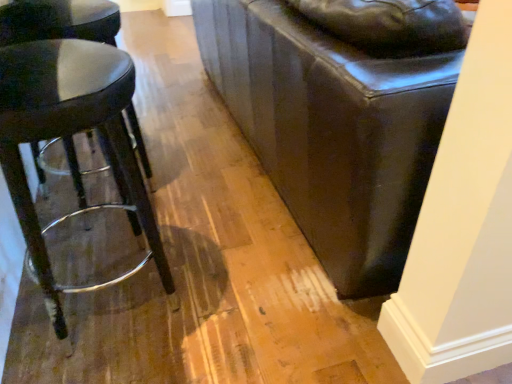
Describe the element at coordinates (58, 20) in the screenshot. I see `matte black stool at left, positioned as the second stool in front-to-back order` at that location.

Measure the distance between matte black stool at left, acting as the first stool starting from the back, and camera.

They are 39.09 inches apart.

Find the location of a particular element. Image resolution: width=512 pixels, height=384 pixels. matte black stool at left, acting as the first stool starting from the back is located at coordinates (58, 20).

The width and height of the screenshot is (512, 384). What do you see at coordinates (69, 133) in the screenshot?
I see `matte black stool at left, marked as the first stool in a front-to-back arrangement` at bounding box center [69, 133].

Where is `matte black stool at left, the second stool viewed from the back`? The width and height of the screenshot is (512, 384). matte black stool at left, the second stool viewed from the back is located at coordinates (69, 133).

In order to face matte black stool at left, the second stool viewed from the back, should I rotate leftwards or rightwards?

Rotate left and turn 22.717 degrees.

Find the location of a particular element. matte black stool at left, acting as the first stool starting from the back is located at coordinates (58, 20).

Which object is positioned more to the right, matte black stool at left, marked as the first stool in a front-to-back arrangement, or matte black stool at left, positioned as the second stool in front-to-back order?

From the viewer's perspective, matte black stool at left, marked as the first stool in a front-to-back arrangement, appears more on the right side.

In the scene shown: Which object is closer to the camera taking this photo, matte black stool at left, the second stool viewed from the back, or matte black stool at left, acting as the first stool starting from the back?

Positioned in front is matte black stool at left, the second stool viewed from the back.

Considering the points (90, 210) and (76, 34), which point is in front, point (90, 210) or point (76, 34)?

The point (76, 34) is closer.

From the image's perspective, which is below, matte black stool at left, the second stool viewed from the back, or matte black stool at left, positioned as the second stool in front-to-back order?

matte black stool at left, the second stool viewed from the back.

From a real-world perspective, is matte black stool at left, marked as the first stool in a front-to-back arrangement, on matte black stool at left, positioned as the second stool in front-to-back order?

Indeed, from a real-world perspective, matte black stool at left, marked as the first stool in a front-to-back arrangement, stands above matte black stool at left, positioned as the second stool in front-to-back order.

Is matte black stool at left, the second stool viewed from the back, thinner than matte black stool at left, acting as the first stool starting from the back?

Yes.

From the picture: Considering the sizes of objects matte black stool at left, marked as the first stool in a front-to-back arrangement, and matte black stool at left, acting as the first stool starting from the back, in the image provided, who is taller, matte black stool at left, marked as the first stool in a front-to-back arrangement, or matte black stool at left, acting as the first stool starting from the back,?

matte black stool at left, acting as the first stool starting from the back.

Considering the relative sizes of matte black stool at left, marked as the first stool in a front-to-back arrangement, and matte black stool at left, positioned as the second stool in front-to-back order, in the image provided, is matte black stool at left, marked as the first stool in a front-to-back arrangement, smaller than matte black stool at left, positioned as the second stool in front-to-back order,?

Yes, matte black stool at left, marked as the first stool in a front-to-back arrangement, is smaller than matte black stool at left, positioned as the second stool in front-to-back order.

Is matte black stool at left, positioned as the second stool in front-to-back order, inside matte black stool at left, the second stool viewed from the back?

That's incorrect, matte black stool at left, positioned as the second stool in front-to-back order, is not inside matte black stool at left, the second stool viewed from the back.

Would you say matte black stool at left, the second stool viewed from the back, is a long distance from matte black stool at left, positioned as the second stool in front-to-back order?

No, matte black stool at left, the second stool viewed from the back, is not far from matte black stool at left, positioned as the second stool in front-to-back order.

Could you tell me if matte black stool at left, marked as the first stool in a front-to-back arrangement, is turned towards matte black stool at left, positioned as the second stool in front-to-back order?

No, matte black stool at left, marked as the first stool in a front-to-back arrangement, is not oriented towards matte black stool at left, positioned as the second stool in front-to-back order.

There is a matte black stool at left, positioned as the second stool in front-to-back order. Identify the location of stool above it (from a real-world perspective). (69, 133).

Looking at this image, considering the relative positions of matte black stool at left, acting as the first stool starting from the back, and matte black stool at left, the second stool viewed from the back, in the image provided, is matte black stool at left, acting as the first stool starting from the back, to the right of matte black stool at left, the second stool viewed from the back, from the viewer's perspective?

No.

In the scene shown: Is matte black stool at left, acting as the first stool starting from the back, closer to the viewer compared to matte black stool at left, marked as the first stool in a front-to-back arrangement?

No, the depth of matte black stool at left, acting as the first stool starting from the back, is greater than that of matte black stool at left, marked as the first stool in a front-to-back arrangement.

Considering the positions of point (146, 171) and point (120, 115), is point (146, 171) closer or farther from the camera than point (120, 115)?

Point (146, 171) is positioned farther from the camera compared to point (120, 115).

From the image's perspective, which is below, matte black stool at left, acting as the first stool starting from the back, or matte black stool at left, marked as the first stool in a front-to-back arrangement?

matte black stool at left, marked as the first stool in a front-to-back arrangement.

From a real-world perspective, is matte black stool at left, positioned as the second stool in front-to-back order, on top of matte black stool at left, the second stool viewed from the back?

Actually, matte black stool at left, positioned as the second stool in front-to-back order, is physically below matte black stool at left, the second stool viewed from the back, in the real world.

Considering the relative sizes of matte black stool at left, positioned as the second stool in front-to-back order, and matte black stool at left, marked as the first stool in a front-to-back arrangement, in the image provided, is matte black stool at left, positioned as the second stool in front-to-back order, thinner than matte black stool at left, marked as the first stool in a front-to-back arrangement,?

In fact, matte black stool at left, positioned as the second stool in front-to-back order, might be wider than matte black stool at left, marked as the first stool in a front-to-back arrangement.

Considering the sizes of matte black stool at left, acting as the first stool starting from the back, and matte black stool at left, marked as the first stool in a front-to-back arrangement, in the image, is matte black stool at left, acting as the first stool starting from the back, taller or shorter than matte black stool at left, marked as the first stool in a front-to-back arrangement,?

A: In the image, matte black stool at left, acting as the first stool starting from the back, appears to be taller than matte black stool at left, marked as the first stool in a front-to-back arrangement.

Considering the relative sizes of matte black stool at left, acting as the first stool starting from the back, and matte black stool at left, the second stool viewed from the back, in the image provided, is matte black stool at left, acting as the first stool starting from the back, bigger than matte black stool at left, the second stool viewed from the back,?

Indeed, matte black stool at left, acting as the first stool starting from the back, has a larger size compared to matte black stool at left, the second stool viewed from the back.

Is matte black stool at left, marked as the first stool in a front-to-back arrangement, completely or partially inside matte black stool at left, acting as the first stool starting from the back?

No, matte black stool at left, marked as the first stool in a front-to-back arrangement, is not surrounded by matte black stool at left, acting as the first stool starting from the back.

Are matte black stool at left, acting as the first stool starting from the back, and matte black stool at left, marked as the first stool in a front-to-back arrangement, making contact?

No, matte black stool at left, acting as the first stool starting from the back, is not touching matte black stool at left, marked as the first stool in a front-to-back arrangement.

Is matte black stool at left, acting as the first stool starting from the back, turned away from matte black stool at left, the second stool viewed from the back?

No, matte black stool at left, acting as the first stool starting from the back,'s orientation is not away from matte black stool at left, the second stool viewed from the back.

What's the angular difference between matte black stool at left, acting as the first stool starting from the back, and matte black stool at left, the second stool viewed from the back,'s facing directions?

matte black stool at left, acting as the first stool starting from the back, and matte black stool at left, the second stool viewed from the back, are facing 6.09e-05 degrees away from each other.

Measure the distance from matte black stool at left, acting as the first stool starting from the back, to matte black stool at left, marked as the first stool in a front-to-back arrangement.

matte black stool at left, acting as the first stool starting from the back, and matte black stool at left, marked as the first stool in a front-to-back arrangement, are 15.06 inches apart from each other.

Find the location of a particular element. The image size is (512, 384). stool behind the matte black stool at left, the second stool viewed from the back is located at coordinates (58, 20).

The image size is (512, 384). Find the location of `stool lying on the left of matte black stool at left, the second stool viewed from the back`. stool lying on the left of matte black stool at left, the second stool viewed from the back is located at coordinates (58, 20).

At what (x,y) coordinates should I click in order to perform the action: click on stool behind the matte black stool at left, marked as the first stool in a front-to-back arrangement. Please return your answer as a coordinate pair (x, y). The height and width of the screenshot is (384, 512). Looking at the image, I should click on (58, 20).